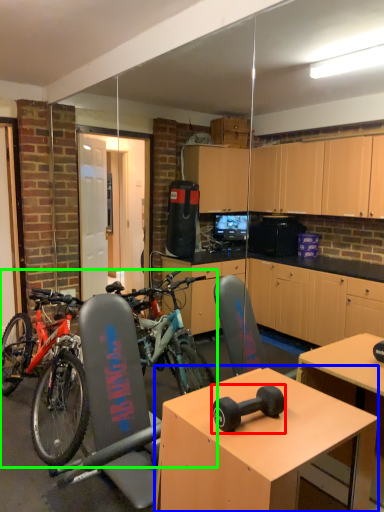
Question: Based on their relative distances, which object is nearer to dumbbell (highlighted by a red box)? Choose from desk (highlighted by a blue box) and bicycle (highlighted by a green box).

Choices:
 (A) desk
 (B) bicycle

Answer: (A)